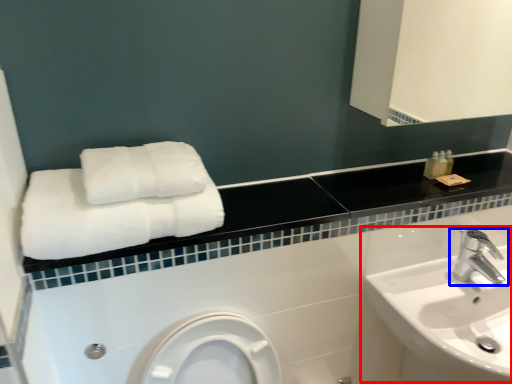
Question: Which object is further to the camera taking this photo, sink (highlighted by a red box) or tap (highlighted by a blue box)?

Choices:
 (A) sink
 (B) tap

Answer: (B)